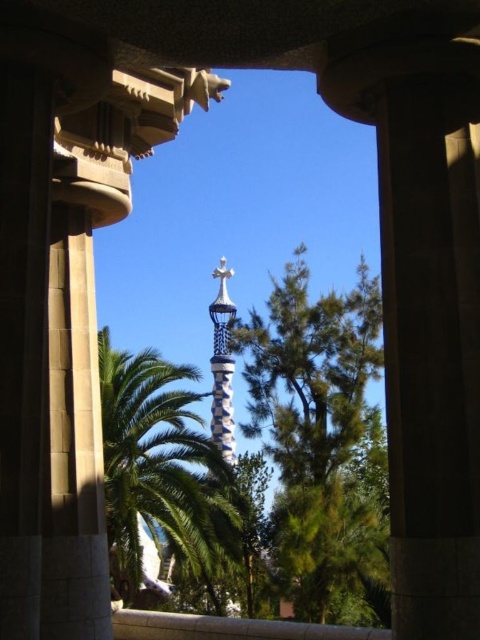
Is green leafy palm tree at center to the left of white mosaic spire at center from the viewer's perspective?

Indeed, green leafy palm tree at center is positioned on the left side of white mosaic spire at center.

Can you confirm if green leafy palm tree at center is wider than white mosaic spire at center?

Indeed, green leafy palm tree at center has a greater width compared to white mosaic spire at center.

Between point (179, 419) and point (213, 440), which one is positioned behind?

Point (213, 440)

Image resolution: width=480 pixels, height=640 pixels. Identify the location of green leafy palm tree at center. (160, 470).

Is green leafy tree at center shorter than green leafy palm tree at center?

No.

Is point (290, 432) in front of point (182, 422)?

No, it is not.

Is point (287, 531) less distant than point (216, 557)?

No, (287, 531) is further to viewer.

You are a GUI agent. You are given a task and a screenshot of the screen. Output one action in this format:
    pyautogui.click(x=<x>, y=<y>)
    Task: Click on the green leafy tree at center
    The height and width of the screenshot is (640, 480).
    Given the screenshot: What is the action you would take?
    pyautogui.click(x=322, y=442)

Looking at this image, does green leafy tree at center have a greater height compared to white mosaic spire at center?

Yes, green leafy tree at center is taller than white mosaic spire at center.

Does point (367, 509) come closer to viewer compared to point (213, 352)?

Yes, point (367, 509) is in front of point (213, 352).

In order to click on green leafy tree at center in this screenshot , I will do `click(322, 442)`.